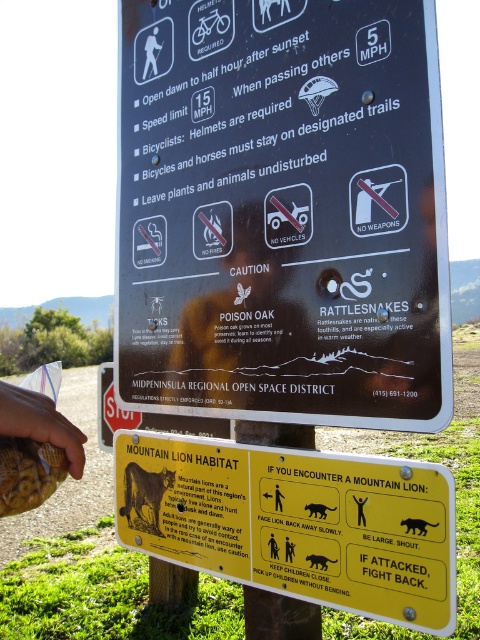
You are a hiker who just arrived at the park entrance. You have a brown textured bag at lower left and a black matte cat at lower right with you. You want to place both items on the ground next to the signs without them getting stolen. Considering their sizes, which item should you place closer to the signs to ensure both are visible and less likely to be taken?

The brown textured bag at lower left is bigger than the black matte cat at lower right, so you should place the larger brown textured bag at lower left closer to the signs. This way, it will be more visible and harder to be taken compared to the smaller black matte cat at lower right.

You are a hiker who wants to locate the black plastic sign at upper center. According to the scene description, where should you look?

The black plastic sign at upper center is located at point (283, 211).